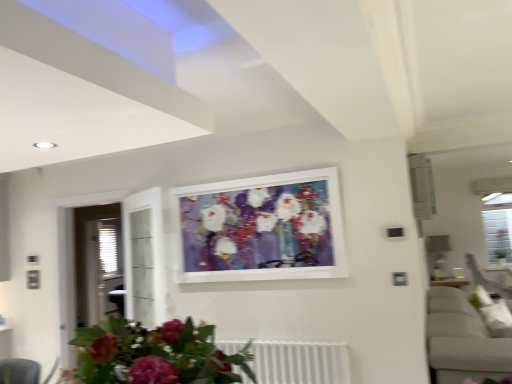
What is the approximate width of matte white picture frame at center?

It is 4.62 inches.

You are a GUI agent. You are given a task and a screenshot of the screen. Output one action in this format:
    pyautogui.click(x=<x>, y=<y>)
    Task: Click on the white metallic radiator at lower center
    This screenshot has width=512, height=384.
    Given the screenshot: What is the action you would take?
    pyautogui.click(x=300, y=362)

The image size is (512, 384). I want to click on matte pink flowers at lower center, so click(154, 354).

You are a GUI agent. You are given a task and a screenshot of the screen. Output one action in this format:
    pyautogui.click(x=<x>, y=<y>)
    Task: Click on the picture frame that appears on the left of white metallic radiator at lower center
    Image resolution: width=512 pixels, height=384 pixels.
    Given the screenshot: What is the action you would take?
    pyautogui.click(x=262, y=228)

Can you tell me how much matte white picture frame at center and white metallic radiator at lower center differ in facing direction?

The facing directions of matte white picture frame at center and white metallic radiator at lower center are 0.0717 degrees apart.

From a real-world perspective, is matte white picture frame at center positioned above or below white metallic radiator at lower center?

From a real-world perspective, matte white picture frame at center is physically above white metallic radiator at lower center.

Is matte white picture frame at center further to camera compared to white metallic radiator at lower center?

Yes, matte white picture frame at center is behind white metallic radiator at lower center.

Where is `picture frame above the white metallic radiator at lower center (from the image's perspective)`? picture frame above the white metallic radiator at lower center (from the image's perspective) is located at coordinates (262, 228).

Does white metallic radiator at lower center appear on the left side of matte white picture frame at center?

No.

Does white metallic radiator at lower center have a larger size compared to matte white picture frame at center?

No.

Is point (251, 350) farther from viewer compared to point (306, 263)?

Yes, it is behind point (306, 263).

Is white metallic radiator at lower center wider or thinner than matte pink flowers at lower center?

Considering their sizes, white metallic radiator at lower center looks slimmer than matte pink flowers at lower center.

Is the position of white metallic radiator at lower center more distant than that of matte pink flowers at lower center?

That is True.

Considering the sizes of white metallic radiator at lower center and matte pink flowers at lower center in the image, is white metallic radiator at lower center taller or shorter than matte pink flowers at lower center?

white metallic radiator at lower center is taller than matte pink flowers at lower center.

Is white metallic radiator at lower center situated inside matte pink flowers at lower center or outside?

white metallic radiator at lower center is outside matte pink flowers at lower center.

Is point (92, 377) closer or farther from the camera than point (211, 197)?

Point (92, 377).

From the image's perspective, is matte pink flowers at lower center on matte white picture frame at center?

Incorrect, from the image's perspective, matte pink flowers at lower center is lower than matte white picture frame at center.

Based on the photo, how many degrees apart are the facing directions of matte pink flowers at lower center and matte white picture frame at center?

180 degrees.

Which is behind, matte pink flowers at lower center or matte white picture frame at center?

matte white picture frame at center is more distant.

Is matte white picture frame at center next to matte pink flowers at lower center?

No, matte white picture frame at center is not touching matte pink flowers at lower center.

Considering the positions of points (193, 207) and (225, 374), is point (193, 207) farther from camera compared to point (225, 374)?

That is True.

Which object is positioned more to the right, matte white picture frame at center or matte pink flowers at lower center?

matte white picture frame at center is more to the right.

Can you confirm if matte white picture frame at center is shorter than matte pink flowers at lower center?

In fact, matte white picture frame at center may be taller than matte pink flowers at lower center.

From a real-world perspective, is matte pink flowers at lower center on top of white metallic radiator at lower center?

Indeed, from a real-world perspective, matte pink flowers at lower center stands above white metallic radiator at lower center.

From the image's perspective, is matte pink flowers at lower center on white metallic radiator at lower center?

Yes, from the image's perspective, matte pink flowers at lower center is over white metallic radiator at lower center.

Considering the positions of point (127, 350) and point (270, 347), is point (127, 350) closer or farther from the camera than point (270, 347)?

Point (127, 350).

How much distance is there between matte pink flowers at lower center and white metallic radiator at lower center?

matte pink flowers at lower center is 1.75 meters from white metallic radiator at lower center.

You are a GUI agent. You are given a task and a screenshot of the screen. Output one action in this format:
    pyautogui.click(x=<x>, y=<y>)
    Task: Click on the radiator in front of the matte white picture frame at center
    The image size is (512, 384).
    Given the screenshot: What is the action you would take?
    pyautogui.click(x=300, y=362)

Where is `picture frame behind the white metallic radiator at lower center`? picture frame behind the white metallic radiator at lower center is located at coordinates (262, 228).

Which object lies further to the anchor point matte pink flowers at lower center, matte white picture frame at center or white metallic radiator at lower center?

matte white picture frame at center.

Based on their spatial positions, is matte pink flowers at lower center or white metallic radiator at lower center further from matte white picture frame at center?

Among the two, matte pink flowers at lower center is located further to matte white picture frame at center.

Looking at the image, which one is located further to matte pink flowers at lower center, white metallic radiator at lower center or matte white picture frame at center?

matte white picture frame at center is positioned further to the anchor matte pink flowers at lower center.

Which object lies further to the anchor point white metallic radiator at lower center, matte white picture frame at center or matte pink flowers at lower center?

Based on the image, matte pink flowers at lower center appears to be further to white metallic radiator at lower center.

Which object lies nearer to the anchor point white metallic radiator at lower center, matte pink flowers at lower center or matte white picture frame at center?

Based on the image, matte white picture frame at center appears to be nearer to white metallic radiator at lower center.

When comparing their distances from matte white picture frame at center, does white metallic radiator at lower center or matte pink flowers at lower center seem closer?

white metallic radiator at lower center.

At what (x,y) coordinates should I click in order to perform the action: click on radiator located between matte pink flowers at lower center and matte white picture frame at center in the depth direction. Please return your answer as a coordinate pair (x, y). Looking at the image, I should click on (300, 362).